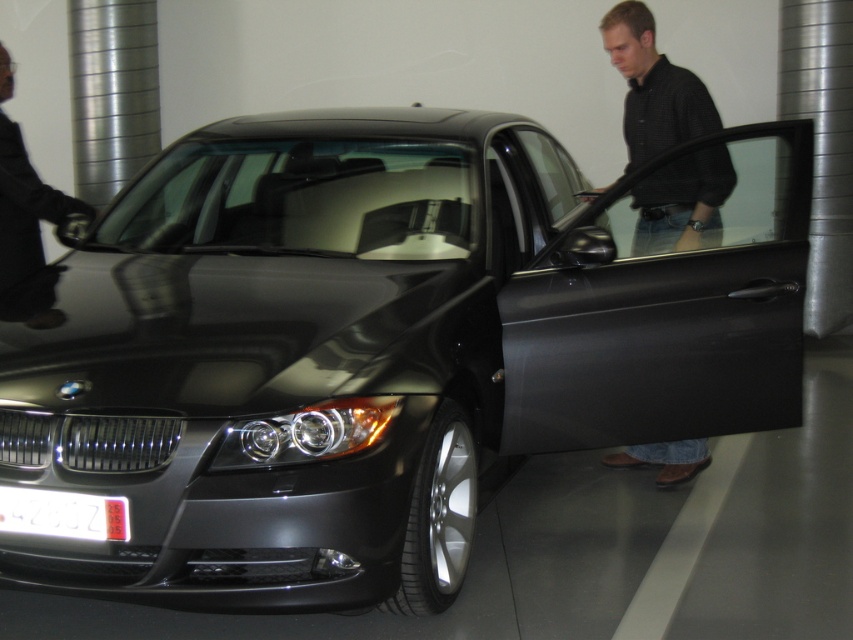
Based on the photo, you are standing in a car showroom and want to get a closer look at the black BMW car. There is a point at coordinates point [28,168] that you need to avoid stepping on. Can you safely approach the car without stepping on that point?

The distance of point [28,168] from viewer is 4.47 meters, so you can safely approach the car as long as you maintain a path that keeps you at least 4.47 meters away from that point.